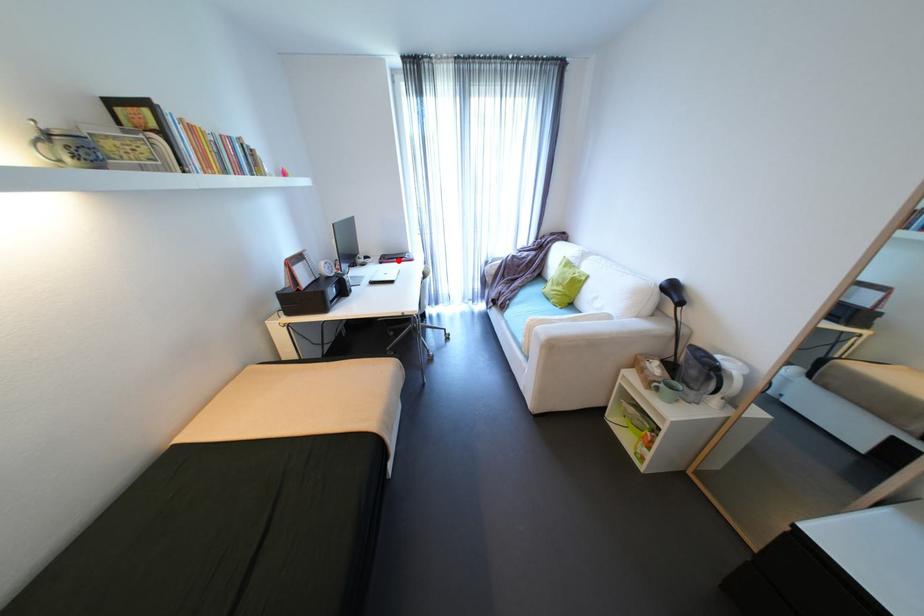
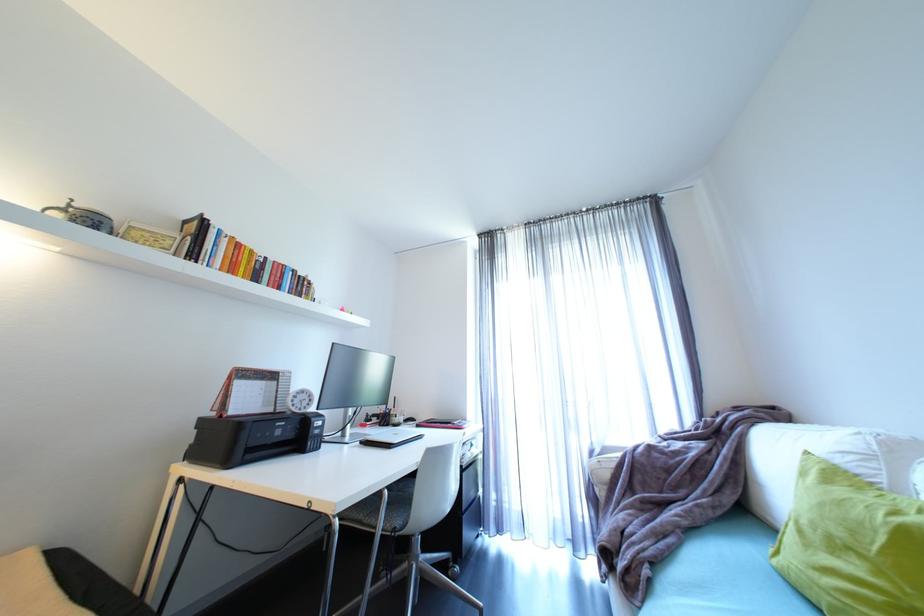
Question: I am providing you with two images of the same scene from different viewpoints. Given a red point in image1, look at the same physical point in image2. Is it:

Choices:
 (A) Closer to the viewpoint
 (B) Farther from the viewpoint

Answer: (B)